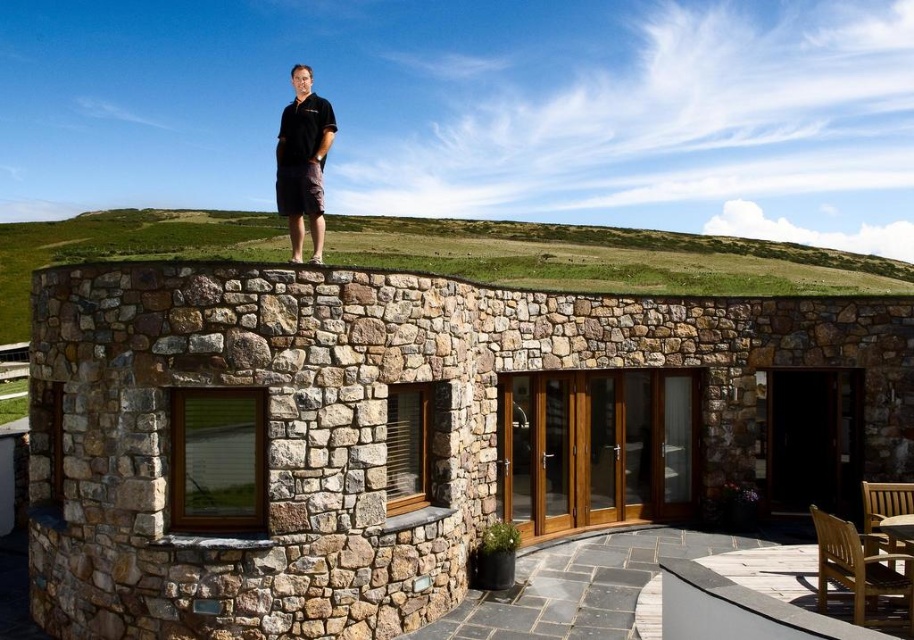
Question: Is white concrete ledge at lower right to the left of black cotton shirt at upper center from the viewer's perspective?

Choices:
 (A) no
 (B) yes

Answer: (A)

Question: Which object appears farthest from the camera in this image?

Choices:
 (A) natural grass at upper center
 (B) white concrete ledge at lower right

Answer: (A)

Question: Which is farther from the white concrete ledge at lower right?

Choices:
 (A) natural grass at upper center
 (B) natural stone wall at upper center

Answer: (A)

Question: Estimate the real-world distances between objects in this image. Which object is closer to the black cotton shirt at upper center?

Choices:
 (A) natural grass at upper center
 (B) white concrete ledge at lower right

Answer: (B)

Question: Is natural grass at upper center to the right of white concrete ledge at lower right from the viewer's perspective?

Choices:
 (A) no
 (B) yes

Answer: (A)

Question: Considering the relative positions of natural grass at upper center and white concrete ledge at lower right in the image provided, where is natural grass at upper center located with respect to white concrete ledge at lower right?

Choices:
 (A) below
 (B) above

Answer: (B)